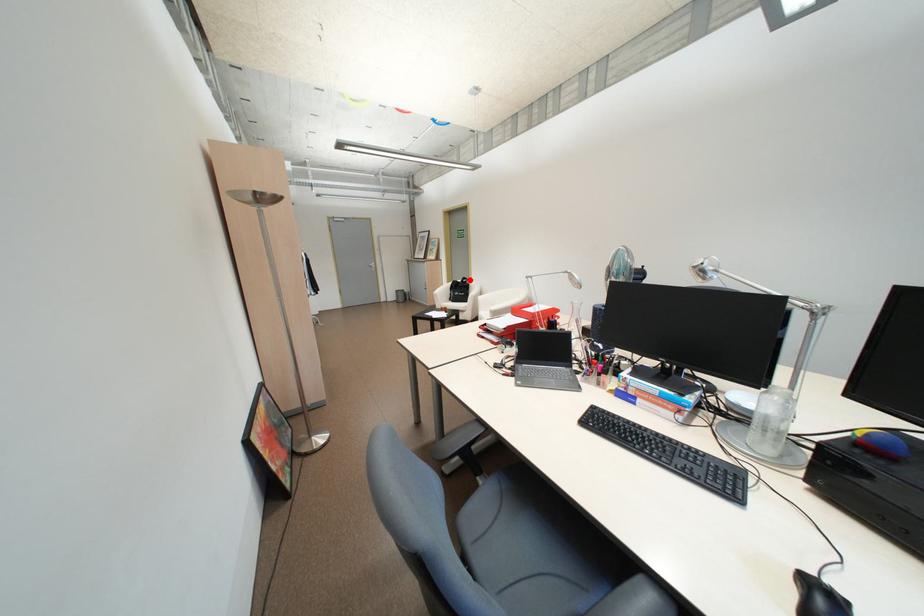
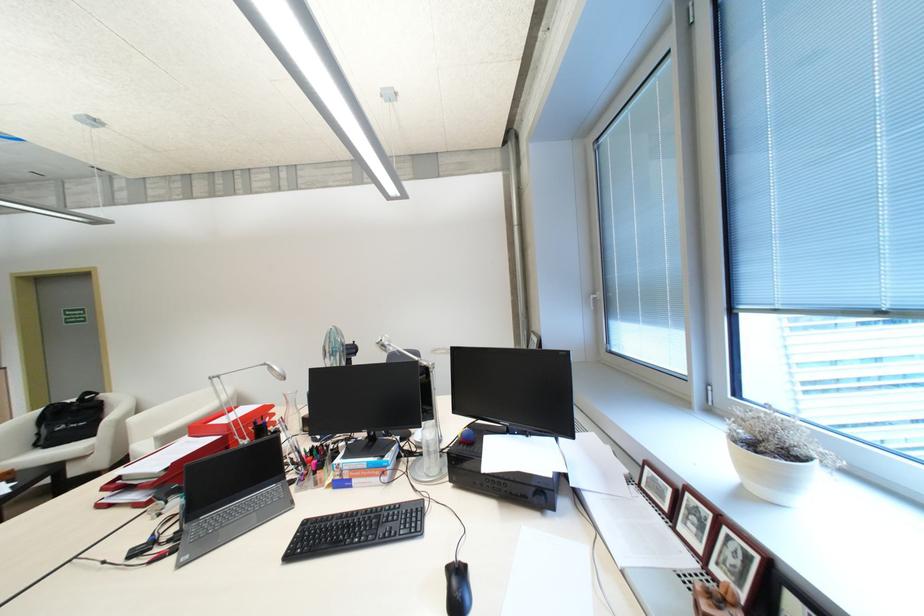
The point at the highlighted location is marked in the first image. Where is the corresponding point in the second image?

(82, 399)